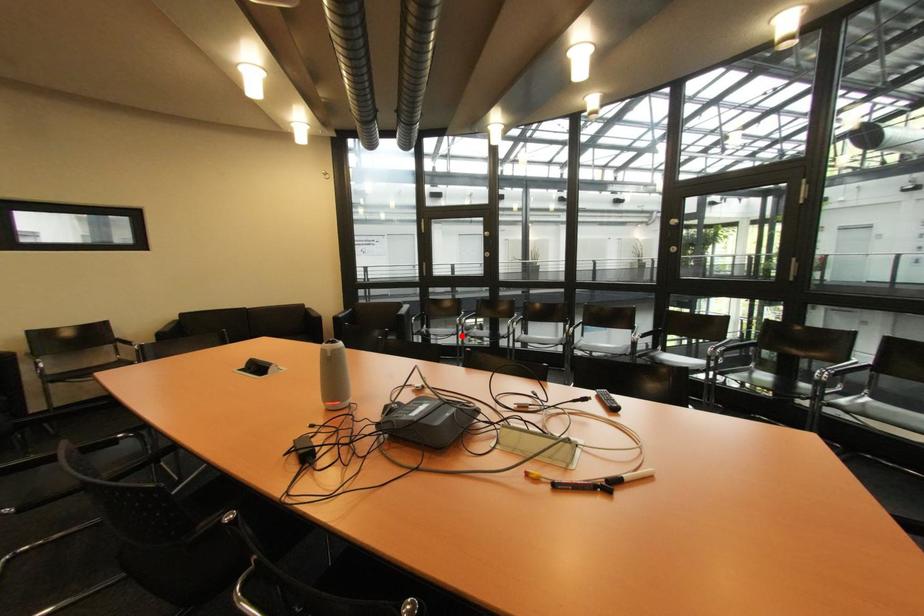
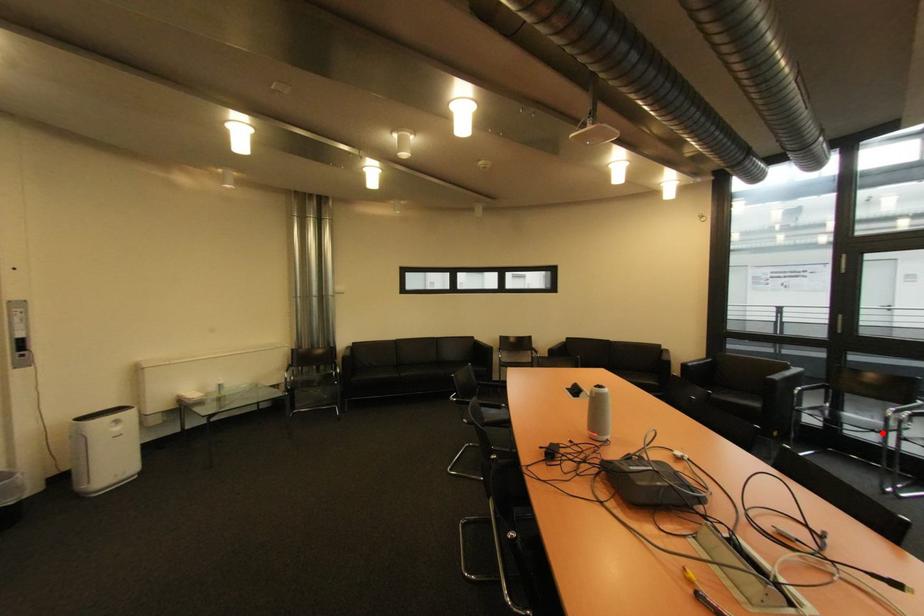
I am providing you with two images of the same scene from different viewpoints. A red point is marked on the first image and another point is marked on the second image. Is the marked point in image1 the same physical position as the marked point in image2?

Yes